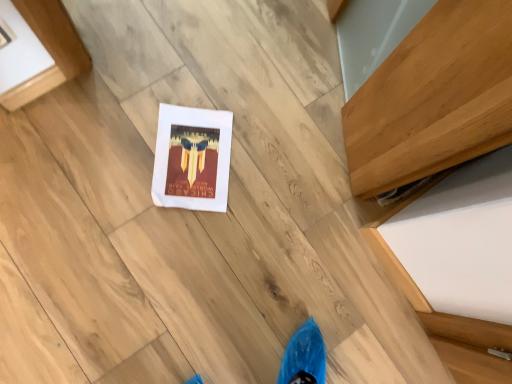
The image size is (512, 384). Describe the element at coordinates (192, 158) in the screenshot. I see `white paper at center` at that location.

What is the approximate height of white paper at center?

white paper at center is 1.20 inches in height.

Locate an element on the screen. Image resolution: width=512 pixels, height=384 pixels. white paper at center is located at coordinates (192, 158).

Locate an element on the screen. This screenshot has height=384, width=512. white paper at center is located at coordinates (192, 158).